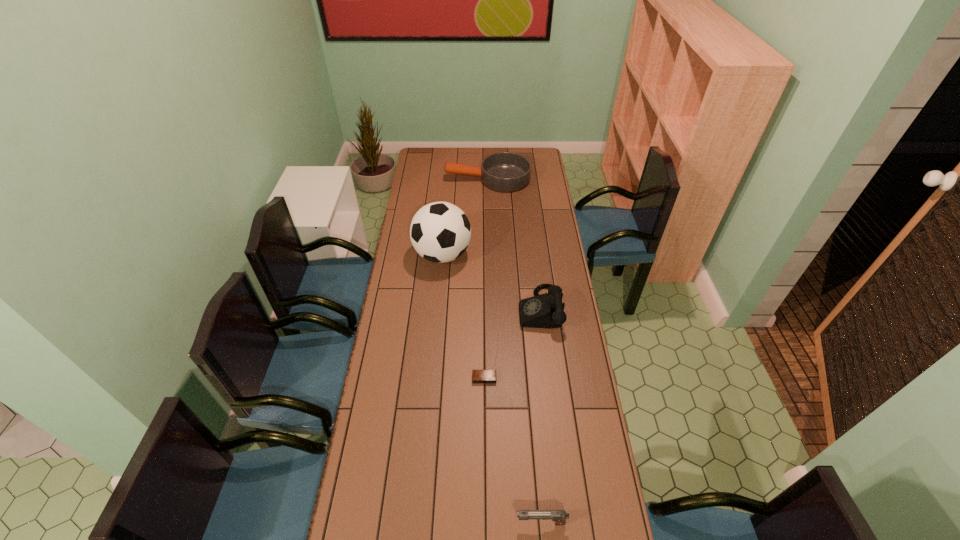
I want to click on free location located on the dial of the second tallest object, so click(468, 309).

Image resolution: width=960 pixels, height=540 pixels. I want to click on vacant space located 0.310m on the dial of the second tallest object, so tap(444, 309).

This screenshot has width=960, height=540. I want to click on vacant area located 0.130m on the handle side of the pan, so click(x=422, y=179).

In order to click on vacant space positioned 0.080m on the handle side of the pan in this screenshot , I will do `click(431, 179)`.

You are a GUI agent. You are given a task and a screenshot of the screen. Output one action in this format:
    pyautogui.click(x=<x>, y=<y>)
    Task: Click on the vacant area situated 0.090m on the handle side of the pan
    This screenshot has height=540, width=960.
    Given the screenshot: What is the action you would take?
    pyautogui.click(x=429, y=179)

The image size is (960, 540). Find the location of `free spot located in the direction the gun is aimed`. free spot located in the direction the gun is aimed is located at coordinates (467, 523).

Where is `blank area located 0.210m in the direction the gun is aimed`? blank area located 0.210m in the direction the gun is aimed is located at coordinates (443, 523).

In order to click on blank area located in the direction the gun is aimed in this screenshot , I will do `click(415, 523)`.

Where is `free space located 0.400m on the front face of the shortest object`? free space located 0.400m on the front face of the shortest object is located at coordinates (486, 504).

Where is `object present at the far edge`? This screenshot has height=540, width=960. object present at the far edge is located at coordinates (505, 171).